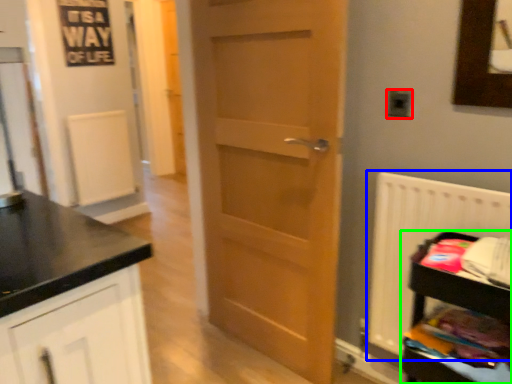
Question: Which object is the farthest from electric outlet (highlighted by a red box)? Choose among these: radiator (highlighted by a blue box) or shelf (highlighted by a green box).

Choices:
 (A) radiator
 (B) shelf

Answer: (B)